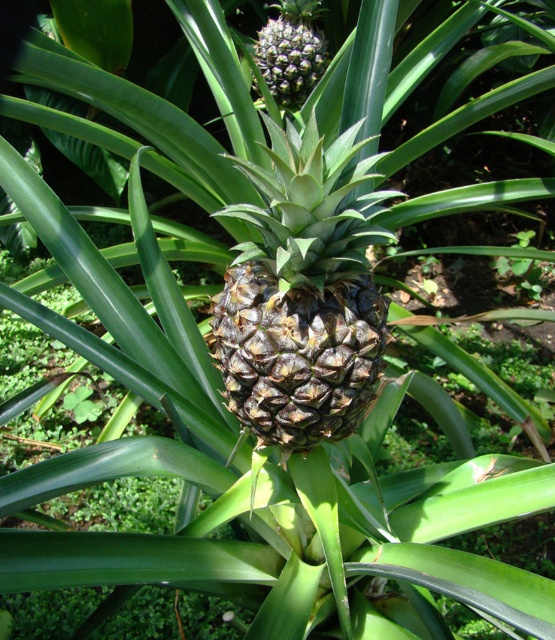
Question: Which object is closer to the camera taking this photo?

Choices:
 (A) brown rough pineapple at center
 (B) spongy brown pineapple at center

Answer: (A)

Question: Is brown rough pineapple at center positioned at the back of spongy brown pineapple at center?

Choices:
 (A) no
 (B) yes

Answer: (A)

Question: Can you confirm if brown rough pineapple at center is positioned above spongy brown pineapple at center?

Choices:
 (A) no
 (B) yes

Answer: (A)

Question: Among these objects, which one is farthest from the camera?

Choices:
 (A) brown rough pineapple at center
 (B) spongy brown pineapple at center

Answer: (B)

Question: Can you confirm if brown rough pineapple at center is positioned to the left of spongy brown pineapple at center?

Choices:
 (A) yes
 (B) no

Answer: (B)

Question: Which point is closer to the camera?

Choices:
 (A) (276, 330)
 (B) (286, 84)

Answer: (A)